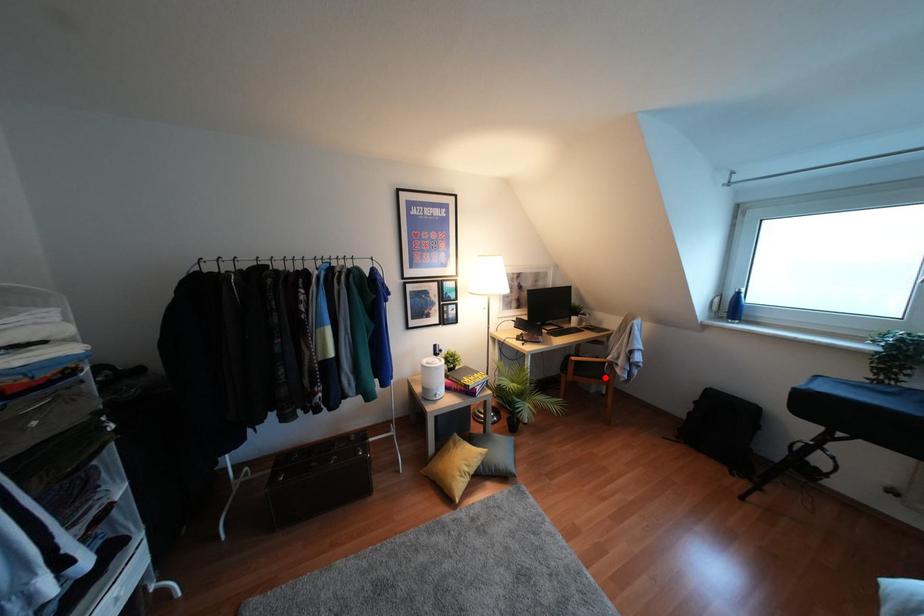
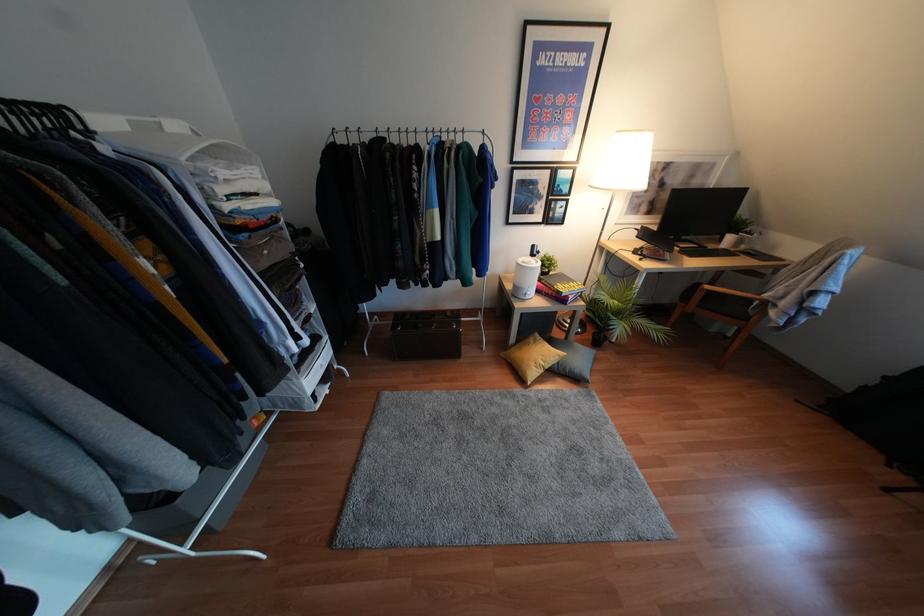
Question: A red point is marked in image1. In image2, is the corresponding 3D point closer to the camera or farther? Reply with the corresponding letter.

Choices:
 (A) The corresponding 3D point is closer.
 (B) The corresponding 3D point is farther.

Answer: (A)